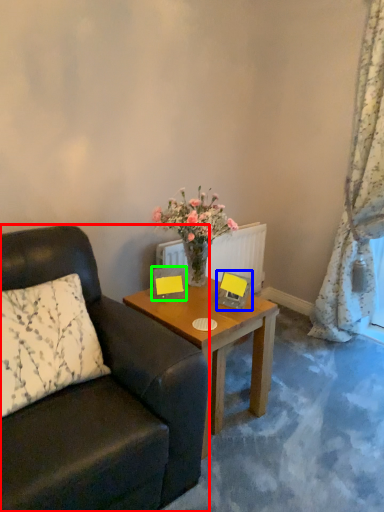
Question: Considering the real-world distances, which object is closest to chair (highlighted by a red box)? picture frame (highlighted by a blue box) or picture frame (highlighted by a green box).

Choices:
 (A) picture frame
 (B) picture frame

Answer: (B)